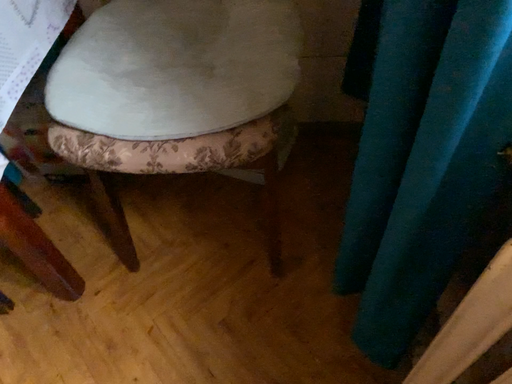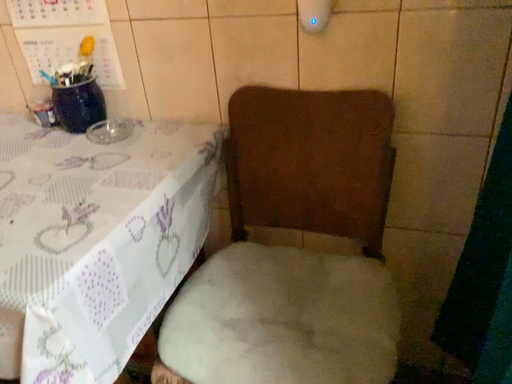
Question: Which way did the camera rotate in the video?

Choices:
 (A) rotated left
 (B) rotated right

Answer: (A)